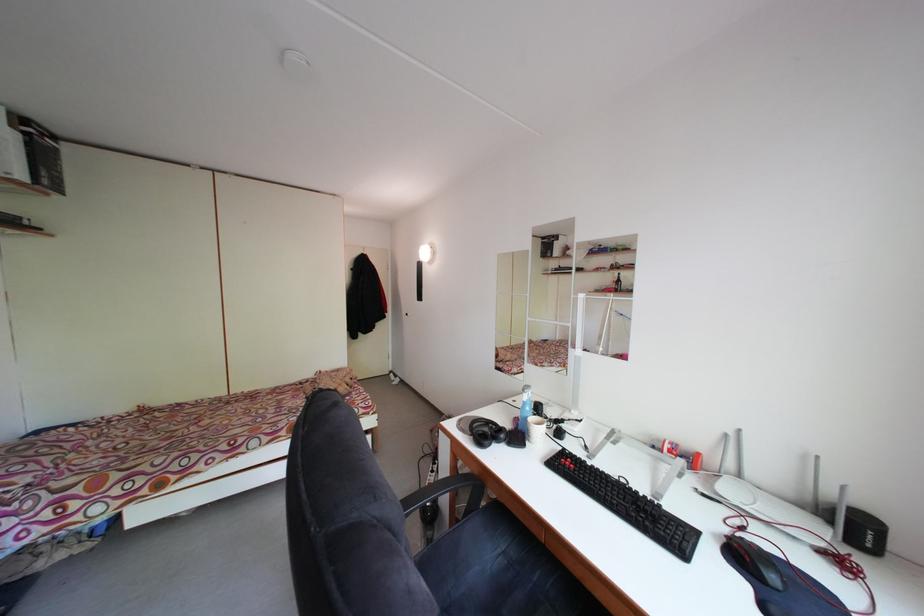
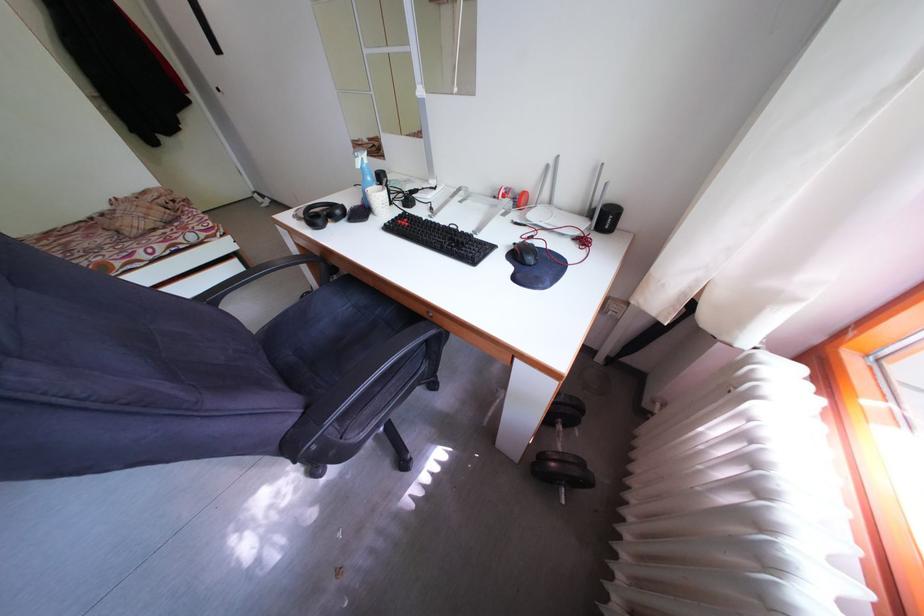
Locate, in the second image, the point that corresponds to point (537, 415) in the first image.

(378, 185)